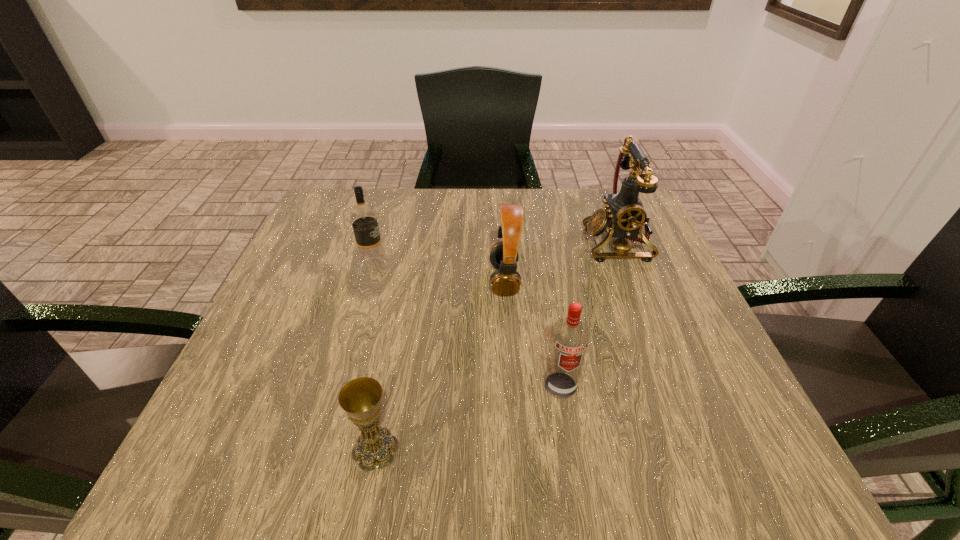
The height and width of the screenshot is (540, 960). Find the location of `object located at the left edge`. object located at the left edge is located at coordinates (364, 221).

I want to click on object at the right edge, so click(624, 216).

The width and height of the screenshot is (960, 540). In order to click on object at the far right corner in this screenshot , I will do `click(624, 216)`.

Identify the location of free space at the far edge. (580, 233).

Identify the location of vacant space at the near edge of the desktop. (571, 451).

Find the location of a particular element. vacant space at the left edge is located at coordinates (316, 385).

In the image, there is a desktop. At what (x,y) coordinates should I click in order to perform the action: click on vacant space at the right edge. Please return your answer as a coordinate pair (x, y). Image resolution: width=960 pixels, height=540 pixels. Looking at the image, I should click on (618, 310).

At what (x,y) coordinates should I click in order to perform the action: click on free region at the far left corner of the desktop. Please return your answer as a coordinate pair (x, y). The width and height of the screenshot is (960, 540). Looking at the image, I should click on (339, 199).

In the image, there is a desktop. Identify the location of vacant space at the near left corner. (202, 448).

At what (x,y) coordinates should I click in order to perform the action: click on vacant space in between the second object from right to left and the chalice. Please return your answer as a coordinate pair (x, y). The height and width of the screenshot is (540, 960). Looking at the image, I should click on (468, 417).